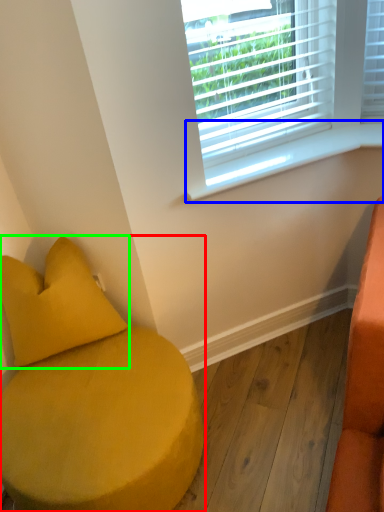
Question: Which is farther away from furniture (highlighted by a red box)? window sill (highlighted by a blue box) or pillow (highlighted by a green box)?

Choices:
 (A) window sill
 (B) pillow

Answer: (A)